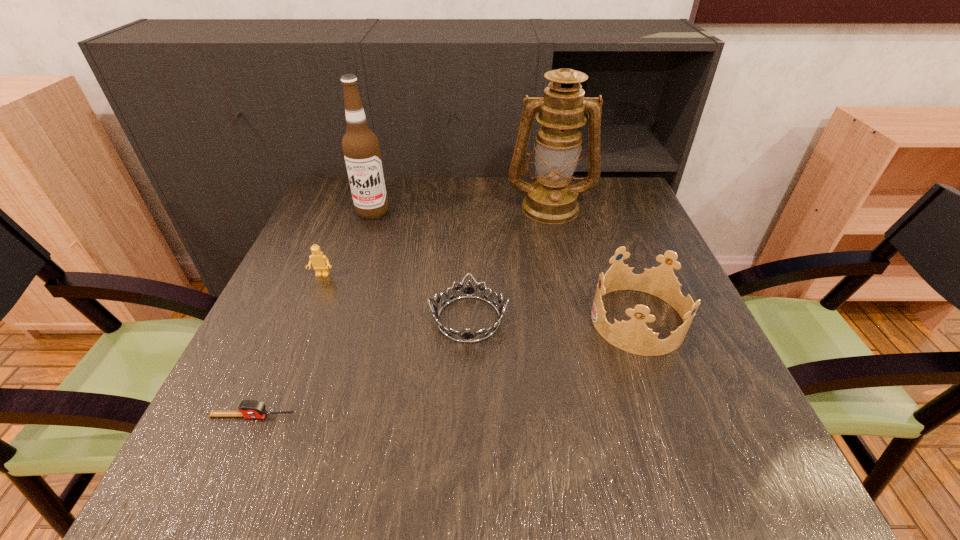
At what (x,y) coordinates should I click in order to perform the action: click on vacant space positioned 0.230m on the left of the oil lamp. Please return your answer as a coordinate pair (x, y). Looking at the image, I should click on [x=423, y=207].

Find the location of `vacant space located on the label of the alcohol`. vacant space located on the label of the alcohol is located at coordinates (365, 237).

Where is `free location located on the front-facing side of the right tiara`? The image size is (960, 540). free location located on the front-facing side of the right tiara is located at coordinates (517, 320).

Locate an element on the screen. free spot located 0.150m on the front-facing side of the right tiara is located at coordinates (517, 320).

Locate an element on the screen. Image resolution: width=960 pixels, height=540 pixels. vacant space positioned on the front-facing side of the right tiara is located at coordinates (503, 320).

The image size is (960, 540). What are the coordinates of `vacant space situated 0.240m on the face of the fourth nearest object` in the screenshot? It's located at (285, 366).

At what (x,y) coordinates should I click in order to perform the action: click on vacant space situated 0.180m on the front-facing side of the left tiara. Please return your answer as a coordinate pair (x, y). Looking at the image, I should click on (597, 319).

Locate an element on the screen. This screenshot has height=540, width=960. free spot located 0.400m on the right of the tape measure is located at coordinates (537, 416).

Where is `oil lamp located in the far edge section of the desktop`? Image resolution: width=960 pixels, height=540 pixels. oil lamp located in the far edge section of the desktop is located at coordinates (551, 199).

Where is `alcohol situated at the far edge`? alcohol situated at the far edge is located at coordinates (361, 149).